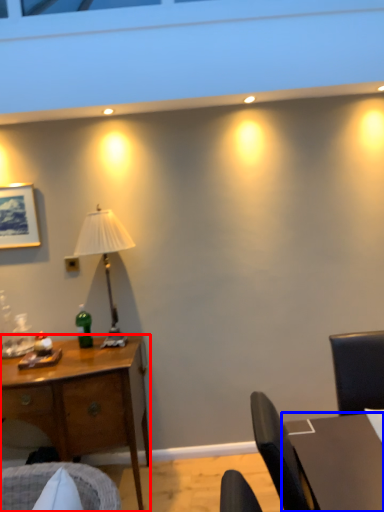
Question: Among these objects, which one is nearest to the camera, desk (highlighted by a red box) or table (highlighted by a blue box)?

Choices:
 (A) desk
 (B) table

Answer: (B)